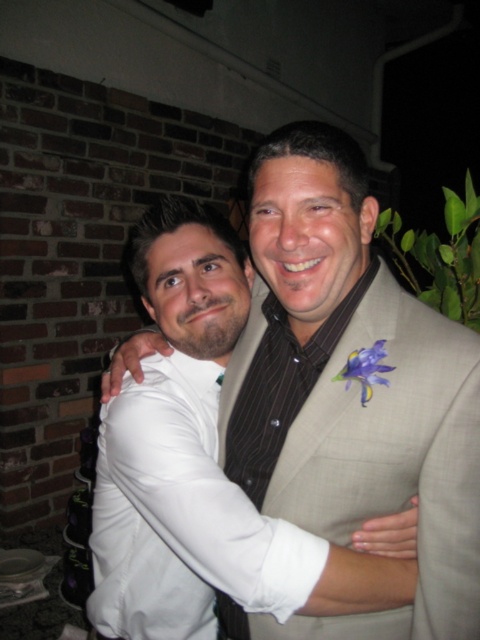
Between white satin dress at center and purple silk flower at center, which one appears on the left side from the viewer's perspective?

Positioned to the left is white satin dress at center.

Who is higher up, white satin dress at center or purple silk flower at center?

purple silk flower at center

Does point (287, 564) come in front of point (348, 356)?

Yes, it is in front of point (348, 356).

Where is `white satin dress at center`? This screenshot has width=480, height=640. white satin dress at center is located at coordinates coord(182,516).

Does white satin shirt at center have a lesser width compared to white satin dress at center?

Incorrect, white satin shirt at center's width is not less than white satin dress at center's.

Does white satin shirt at center appear on the left side of white satin dress at center?

No, white satin shirt at center is not to the left of white satin dress at center.

Does point (453, 406) come closer to viewer compared to point (217, 497)?

That is True.

At what (x,y) coordinates should I click in order to perform the action: click on white satin shirt at center. Please return your answer as a coordinate pair (x, y). This screenshot has height=640, width=480. Looking at the image, I should click on (348, 392).

Can you confirm if white satin shirt at center is positioned to the right of purple silk flower at center?

In fact, white satin shirt at center is to the left of purple silk flower at center.

Which is behind, point (336, 387) or point (367, 349)?

The point (336, 387) is behind.

The image size is (480, 640). What are the coordinates of `white satin shirt at center` in the screenshot? It's located at (348, 392).